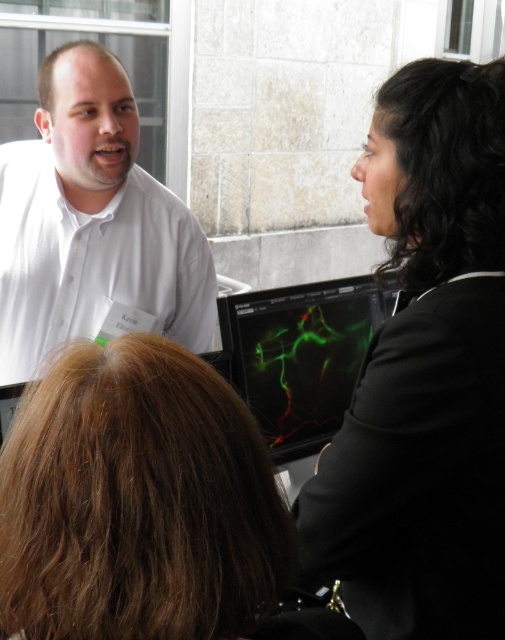
Does brown hair at center lie behind white smooth shirt at upper left?

No, it is not.

Between brown hair at center and white smooth shirt at upper left, which one appears on the right side from the viewer's perspective?

brown hair at center

Who is more distant from viewer, (152, 413) or (85, 173)?

Point (85, 173)

Image resolution: width=505 pixels, height=640 pixels. In order to click on brown hair at center in this screenshot , I will do `click(143, 506)`.

Is white smooth shirt at upper left thinner than green matte screen at center?

In fact, white smooth shirt at upper left might be wider than green matte screen at center.

Which is in front, point (198, 340) or point (275, 428)?

Point (275, 428) is in front.

The height and width of the screenshot is (640, 505). What are the coordinates of `white smooth shirt at upper left` in the screenshot? It's located at (91, 224).

Is black smooth suit at right further to the viewer compared to brown hair at center?

Yes, it is.

Does point (475, 348) lie behind point (240, 488)?

That is True.

Find the location of a particular element. black smooth suit at right is located at coordinates tap(426, 372).